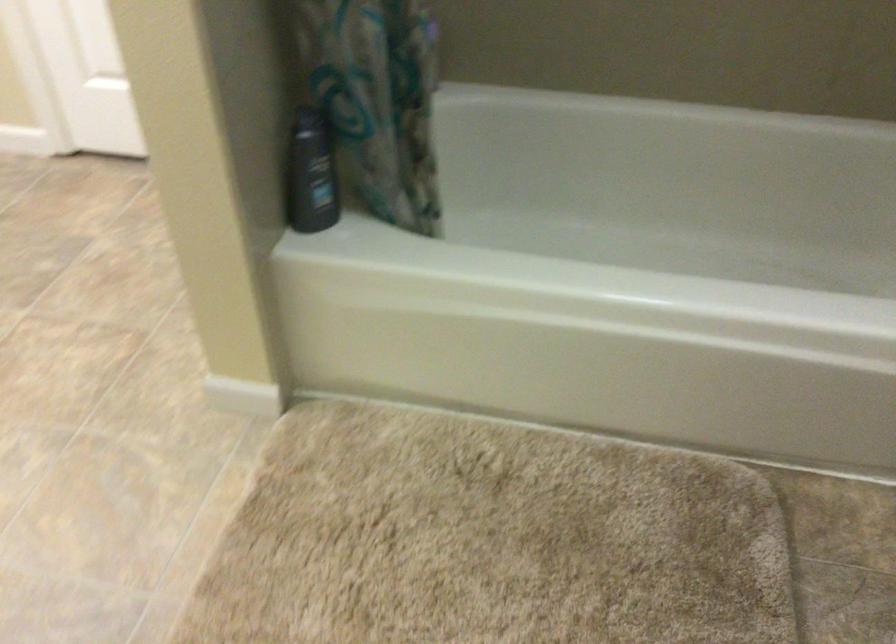
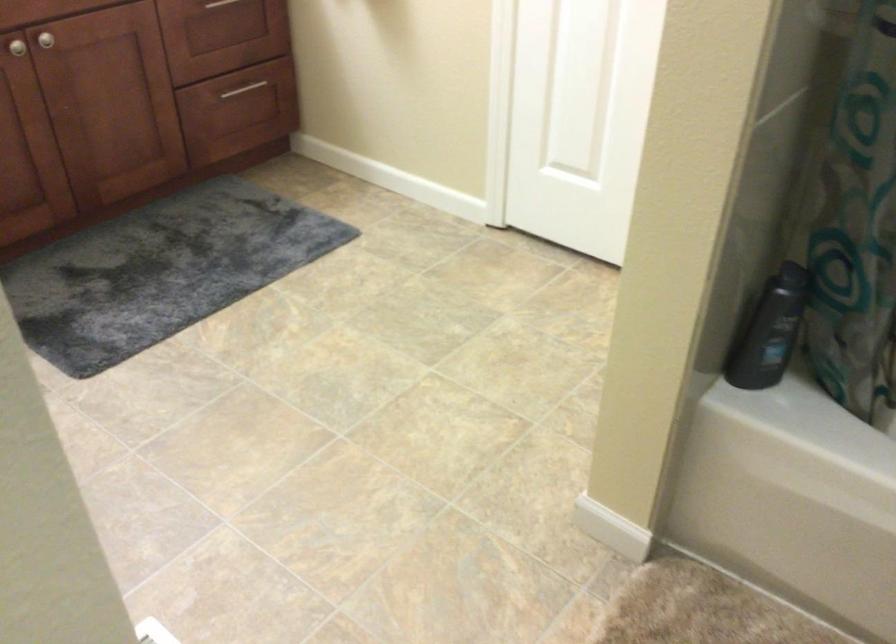
Question: In a continuous first-person perspective shot, in which direction is the camera moving?

Choices:
 (A) Left
 (B) Right
 (C) Forward
 (D) Backward

Answer: (A)